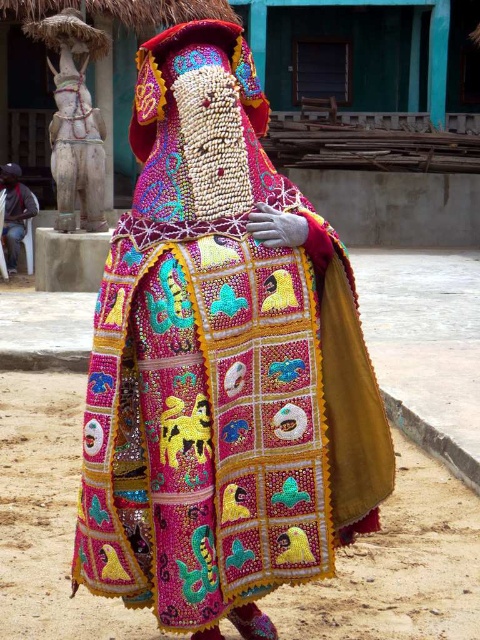
You are a photographer setting up for a cultural performance. You need to ensure the beaded fabric costume at center and the black fabric at lower left are both visible in your shot. Given their sizes, which object should you focus on to ensure both are in frame?

The beaded fabric costume at center is larger than the black fabric at lower left. To ensure both are visible, focus on positioning the camera so the larger beaded fabric costume at center is centered, allowing the smaller black fabric at lower left to fit within the frame.

You are a photographer taking a picture of the costume. You notice two points marked on the costume. The first point is at coordinate point (229,465) and the second is at point (16,170). Which point should you focus on first if you want to capture the part of the costume that is closer to the camera?

Point (229,465) is in front of point (16,170), so you should focus on point (229,465) first as it is closer to the camera.

You are a photographer setting up a shoot in the scene described. You need to position a spotlight so that it illuminates the beaded fabric costume at center without casting a shadow on the black fabric at lower left. Given their positions, is this possible?

The beaded fabric costume at center is located below the black fabric at lower left. Since the costume is below the black fabric, positioning the spotlight above the black fabric would allow light to shine downward onto the costume while avoiding casting a shadow on the black fabric at lower left.